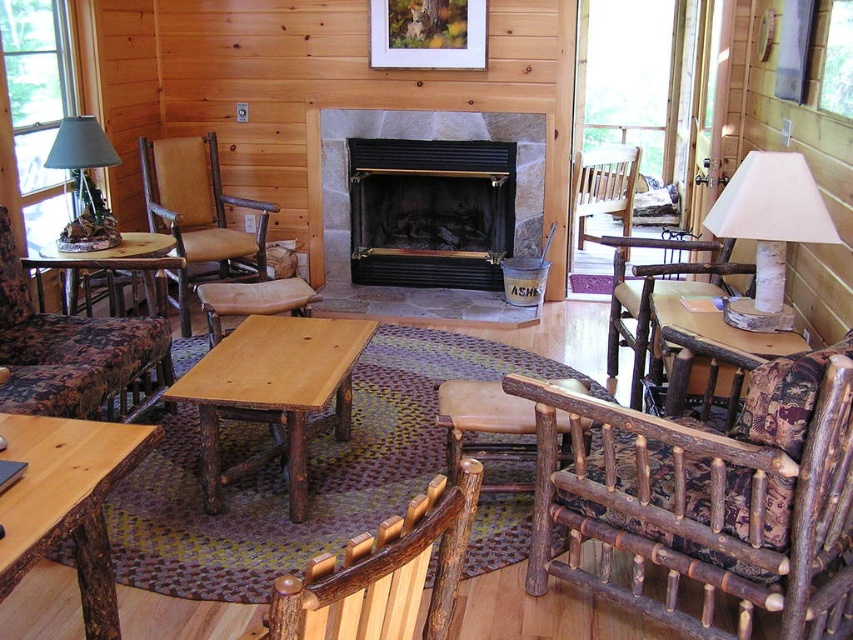
You are standing in the center of the room and want to place a decorative vase on the natural wood table at center. According to the coordinates provided, is the table directly in front of you or to your side?

The natural wood table at center is located at coordinates point (273, 392), which means it is not directly in front of you but slightly to your right and forward.

You are sitting in the floral fabric armchair at left and want to reach the natural wood table at center to grab a book. In which direction should you move to get to the table?

You should move to your right to reach the natural wood table at center because it is located to the right of the floral fabric armchair at left.